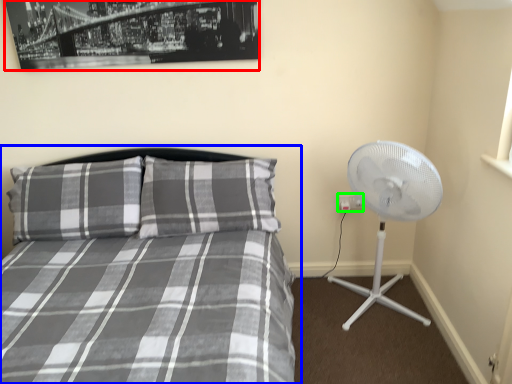
Question: Which object is the farthest from picture frame (highlighted by a red box)? Choose among these: bed (highlighted by a blue box) or electric outlet (highlighted by a green box).

Choices:
 (A) bed
 (B) electric outlet

Answer: (B)